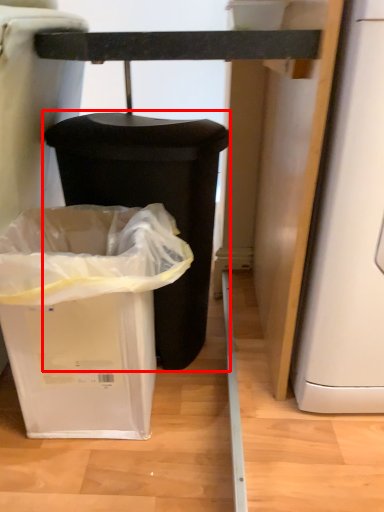
Question: From the image, what is the correct spatial relationship of waste container (annotated by the red box) in relation to waste container?

Choices:
 (A) right
 (B) left

Answer: (A)